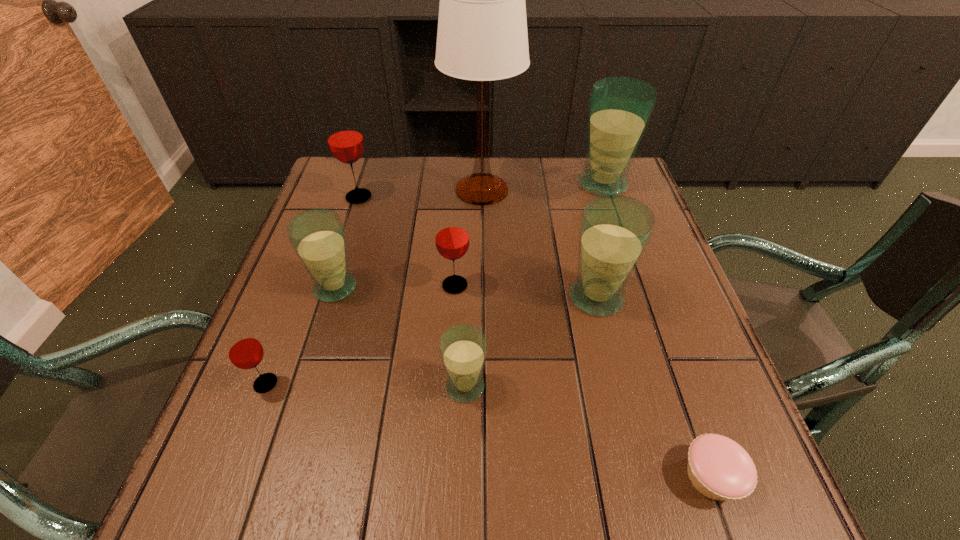
I want to click on free location located 0.110m on the right of the second smallest blue glass, so click(x=409, y=288).

Identify the location of vacant space located 0.100m on the back of the smallest red glass. (287, 328).

Find the location of a particular element. This screenshot has height=540, width=960. free space located 0.320m on the back of the nearest blue glass is located at coordinates (468, 252).

Identify the location of vacant space located 0.280m on the back of the cupcake. (654, 314).

The height and width of the screenshot is (540, 960). What are the coordinates of `table lamp situated at the far edge` in the screenshot? It's located at (482, 36).

What are the coordinates of `object present at the near edge` in the screenshot? It's located at (719, 468).

Locate an element on the screen. Image resolution: width=960 pixels, height=540 pixels. cupcake at the right edge is located at coordinates (719, 468).

The height and width of the screenshot is (540, 960). What are the coordinates of `object present at the far left corner` in the screenshot? It's located at (345, 140).

Locate an element on the screen. The width and height of the screenshot is (960, 540). object present at the far right corner is located at coordinates (620, 108).

The width and height of the screenshot is (960, 540). Identify the location of object located at the near right corner. (719, 468).